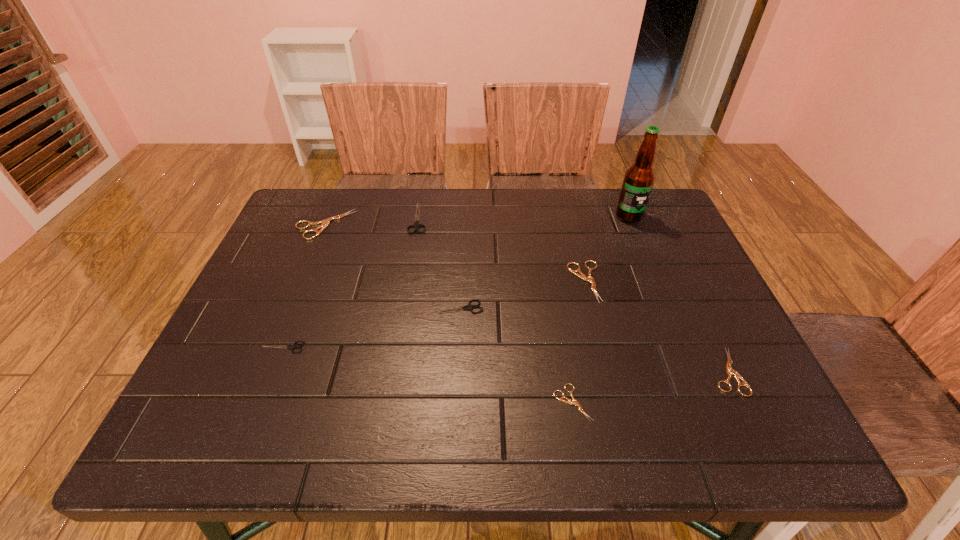
Find the location of a particular element. This screenshot has width=960, height=540. the rightmost shears is located at coordinates pos(730,371).

Locate an element on the screen. the second smallest beige shears is located at coordinates (730, 371).

Locate an element on the screen. This screenshot has width=960, height=540. the nearest black shears is located at coordinates (293, 346).

I want to click on the smallest black shears, so 293,346.

You are a GUI agent. You are given a task and a screenshot of the screen. Output one action in this format:
    pyautogui.click(x=<x>, y=<y>)
    Task: Click on the shortest object
    The width and height of the screenshot is (960, 540).
    Given the screenshot: What is the action you would take?
    coord(574,402)

Where is `the shortest shears`? The image size is (960, 540). the shortest shears is located at coordinates 574,402.

Locate an element on the screen. vacant space located on the label of the brown beer bottle is located at coordinates (652, 272).

At what (x,y) coordinates should I click in order to perform the action: click on vacant space located 0.050m on the left of the biggest black shears. Please return your answer as a coordinate pair (x, y). This screenshot has height=540, width=960. Looking at the image, I should click on (392, 218).

Identify the location of vacant region located 0.150m on the front of the leftmost beige shears. (303, 278).

At what (x,y) coordinates should I click in order to perform the action: click on blank space located on the front of the second smallest black shears. Please return your answer as a coordinate pair (x, y). Image resolution: width=960 pixels, height=540 pixels. Looking at the image, I should click on (451, 431).